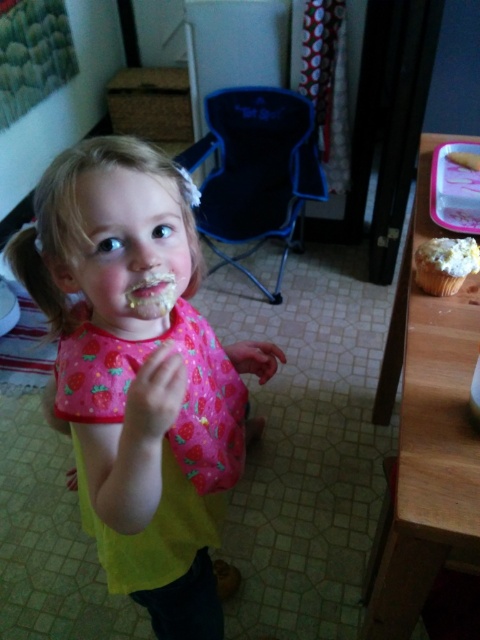
Question: From the image, what is the correct spatial relationship of pink fabric bib at center in relation to white frosted cupcake at upper right?

Choices:
 (A) left
 (B) right

Answer: (A)

Question: Is pink fabric bib at center wider than matte pink bib at center?

Choices:
 (A) yes
 (B) no

Answer: (A)

Question: Which of the following is the farthest from the observer?

Choices:
 (A) (147, 291)
 (B) (420, 285)

Answer: (B)

Question: Which point is closer to the camera?

Choices:
 (A) matte pink bib at center
 (B) white frosted cupcake at upper right
 (C) pink fabric bib at center

Answer: (C)

Question: Can you confirm if pink fabric bib at center is positioned to the right of white frosted cupcake at upper right?

Choices:
 (A) no
 (B) yes

Answer: (A)

Question: Which object appears closest to the camera in this image?

Choices:
 (A) pink fabric bib at center
 (B) matte pink bib at center

Answer: (A)